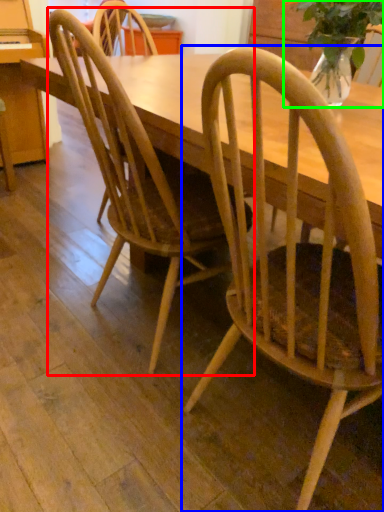
Question: Which object is the farthest from chair (highlighted by a red box)? Choose among these: chair (highlighted by a blue box) or houseplant (highlighted by a green box).

Choices:
 (A) chair
 (B) houseplant

Answer: (B)